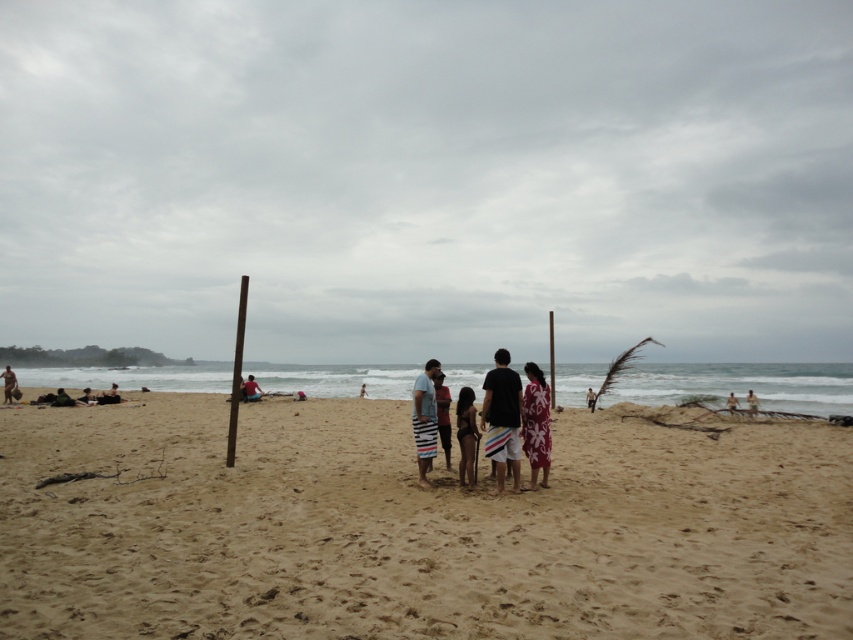
Question: Is brown wooden pole at left thinner than light brown wooden pole at center?

Choices:
 (A) yes
 (B) no

Answer: (A)

Question: Among these objects, which one is farthest from the camera?

Choices:
 (A) white floral dress at center
 (B) brown wooden pole at center
 (C) light brown wooden pole at center

Answer: (C)

Question: Is striped board shorts at center behind matte black surfboard at left?

Choices:
 (A) no
 (B) yes

Answer: (A)

Question: Which point is farther from the camera taking this photo?

Choices:
 (A) (428, 444)
 (B) (57, 403)
 (C) (109, 433)
 (D) (257, 396)

Answer: (D)

Question: Which is nearer to the brown textured surfboard at center?

Choices:
 (A) white floral dress at center
 (B) matte black surfboard at left

Answer: (A)

Question: Does green fabric person at lower left appear on the right side of dark blue fabric shorts at center?

Choices:
 (A) yes
 (B) no

Answer: (B)